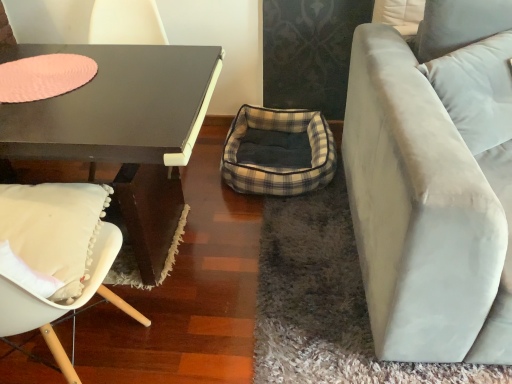
Question: Is white fabric chair at left to the right of matte black table at left from the viewer's perspective?

Choices:
 (A) yes
 (B) no

Answer: (B)

Question: Is white fabric chair at left facing towards matte black table at left?

Choices:
 (A) yes
 (B) no

Answer: (A)

Question: Is white fabric chair at left oriented away from matte black table at left?

Choices:
 (A) no
 (B) yes

Answer: (A)

Question: Can you confirm if white fabric chair at left is thinner than matte black table at left?

Choices:
 (A) yes
 (B) no

Answer: (B)

Question: Can you confirm if white fabric chair at left is shorter than matte black table at left?

Choices:
 (A) yes
 (B) no

Answer: (B)

Question: Is white fabric chair at left outside matte black table at left?

Choices:
 (A) no
 (B) yes

Answer: (B)

Question: Does white fabric chair at left have a lesser width compared to light beige fabric couch at right?

Choices:
 (A) yes
 (B) no

Answer: (A)

Question: Considering the relative positions of white fabric chair at left and light beige fabric couch at right in the image provided, is white fabric chair at left to the left of light beige fabric couch at right from the viewer's perspective?

Choices:
 (A) no
 (B) yes

Answer: (B)

Question: Is white fabric chair at left not near light beige fabric couch at right?

Choices:
 (A) yes
 (B) no

Answer: (B)

Question: Does white fabric chair at left appear on the right side of light beige fabric couch at right?

Choices:
 (A) yes
 (B) no

Answer: (B)

Question: Does white fabric chair at left lie behind light beige fabric couch at right?

Choices:
 (A) no
 (B) yes

Answer: (A)

Question: From a real-world perspective, is white fabric chair at left located higher than light beige fabric couch at right?

Choices:
 (A) yes
 (B) no

Answer: (A)

Question: From a real-world perspective, is white fabric pillow at upper right physically below pink felt placemat at upper left?

Choices:
 (A) yes
 (B) no

Answer: (A)